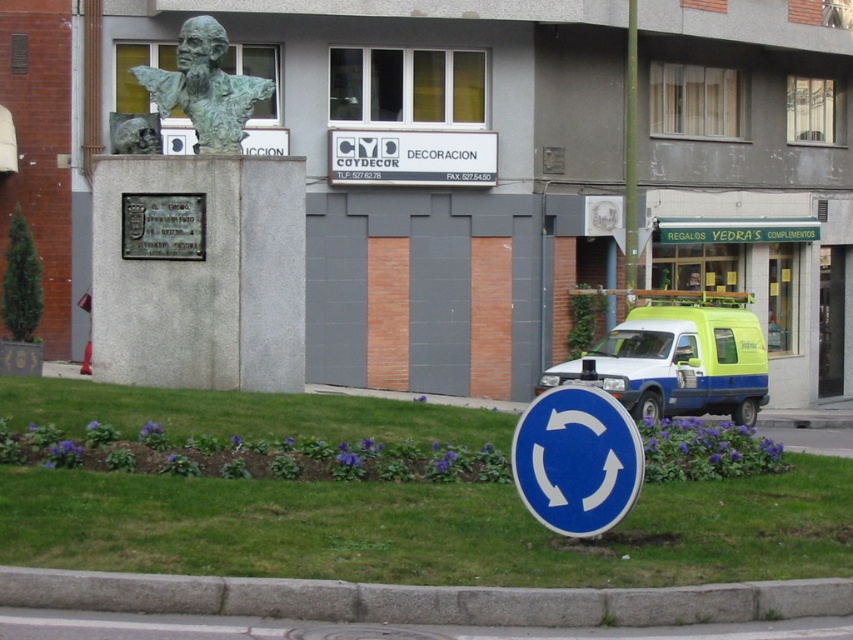
Does point (527, 413) come in front of point (428, 132)?

Yes, it is in front of point (428, 132).

Between point (514, 449) and point (402, 163), which one is positioned in front?

Point (514, 449) is more forward.

You are a GUI agent. You are given a task and a screenshot of the screen. Output one action in this format:
    pyautogui.click(x=<x>, y=<y>)
    Task: Click on the blue metallic traffic sign at center
    Image resolution: width=853 pixels, height=640 pixels.
    Given the screenshot: What is the action you would take?
    pyautogui.click(x=576, y=460)

Who is more forward, (492, 440) or (196, 104)?

Point (492, 440) is in front.

I want to click on green grass at lower center, so click(426, 529).

Can you confirm if green grass at lower center is thinner than white matte van at center?

Correct, green grass at lower center's width is less than white matte van at center's.

Which is in front, point (786, 461) or point (741, 385)?

Positioned in front is point (786, 461).

I want to click on green grass at lower center, so click(426, 529).